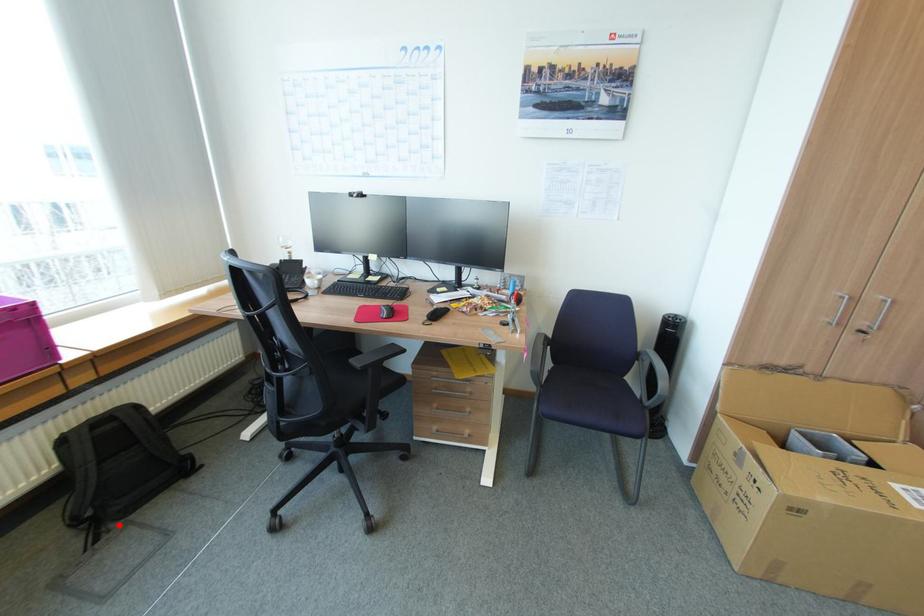
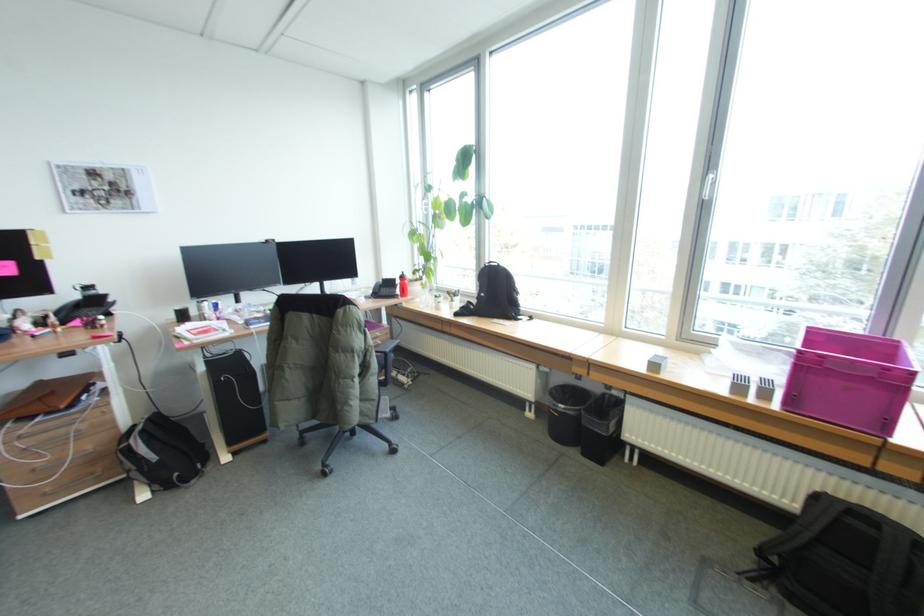
In the second image, find the point that corresponds to the highlighted location in the first image.

(781, 593)